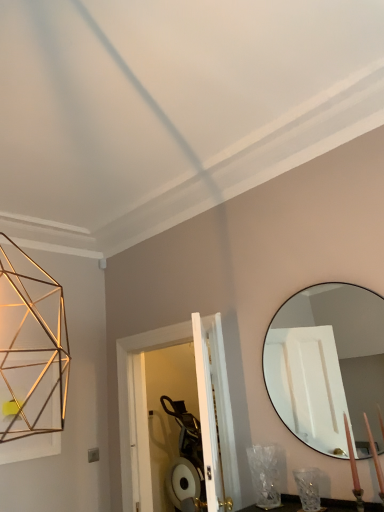
Question: Is matte black mirror at right inside candle at lower right?

Choices:
 (A) no
 (B) yes

Answer: (A)

Question: Does candle at lower right have a lesser width compared to matte black mirror at right?

Choices:
 (A) yes
 (B) no

Answer: (B)

Question: Is candle at lower right to the right of matte black mirror at right from the viewer's perspective?

Choices:
 (A) no
 (B) yes

Answer: (B)

Question: From the image's perspective, is candle at lower right below matte black mirror at right?

Choices:
 (A) no
 (B) yes

Answer: (B)

Question: Is candle at lower right wider than matte black mirror at right?

Choices:
 (A) yes
 (B) no

Answer: (A)

Question: Would you say candle at lower right is inside or outside matte black mirror at right?

Choices:
 (A) outside
 (B) inside

Answer: (A)

Question: Does point (374, 445) appear closer or farther from the camera than point (340, 446)?

Choices:
 (A) farther
 (B) closer

Answer: (B)

Question: In terms of width, does candle at lower right look wider or thinner when compared to matte black mirror at right?

Choices:
 (A) thin
 (B) wide

Answer: (B)

Question: Relative to matte black mirror at right, is candle at lower right in front or behind?

Choices:
 (A) behind
 (B) front

Answer: (B)

Question: Considering the positions of candle at lower right and clear glass vase at lower right in the image, is candle at lower right bigger or smaller than clear glass vase at lower right?

Choices:
 (A) big
 (B) small

Answer: (B)

Question: Would you say candle at lower right is to the left or to the right of clear glass vase at lower right in the picture?

Choices:
 (A) right
 (B) left

Answer: (A)

Question: From the image's perspective, is candle at lower right positioned above or below clear glass vase at lower right?

Choices:
 (A) above
 (B) below

Answer: (A)

Question: In terms of height, does candle at lower right look taller or shorter compared to clear glass vase at lower right?

Choices:
 (A) tall
 (B) short

Answer: (A)

Question: Does point (322, 414) appear closer or farther from the camera than point (370, 435)?

Choices:
 (A) closer
 (B) farther

Answer: (B)

Question: In terms of size, does matte black mirror at right appear bigger or smaller than candle at lower right?

Choices:
 (A) big
 (B) small

Answer: (A)